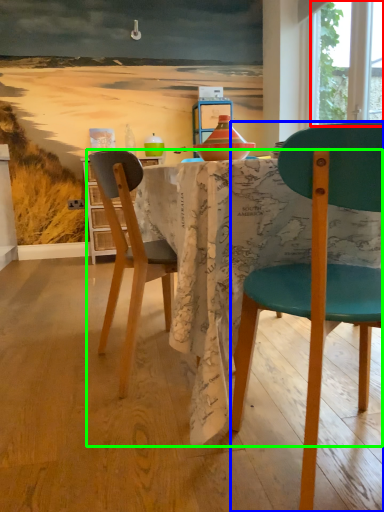
Question: Which object is positioned farthest from window screen (highlighted by a red box)? Select from chair (highlighted by a blue box) and kitchen & dining room table (highlighted by a green box).

Choices:
 (A) chair
 (B) kitchen & dining room table

Answer: (A)